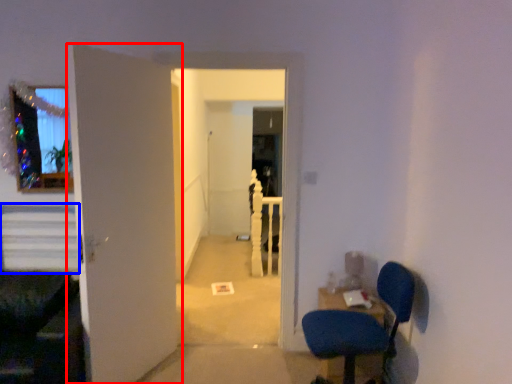
Question: Which of the following is the farthest to the observer, door (highlighted by a red box) or stairs (highlighted by a blue box)?

Choices:
 (A) door
 (B) stairs

Answer: (B)